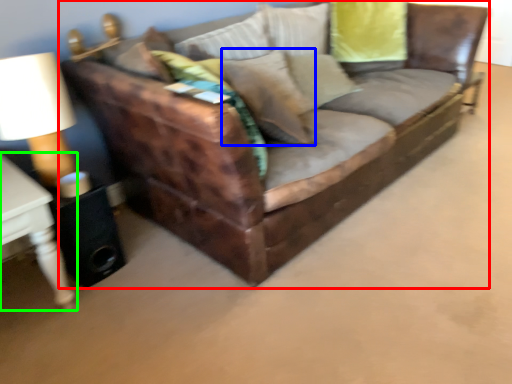
Question: Estimate the real-world distances between objects in this image. Which object is closer to studio couch (highlighted by a red box), pillow (highlighted by a blue box) or table (highlighted by a green box)?

Choices:
 (A) pillow
 (B) table

Answer: (A)